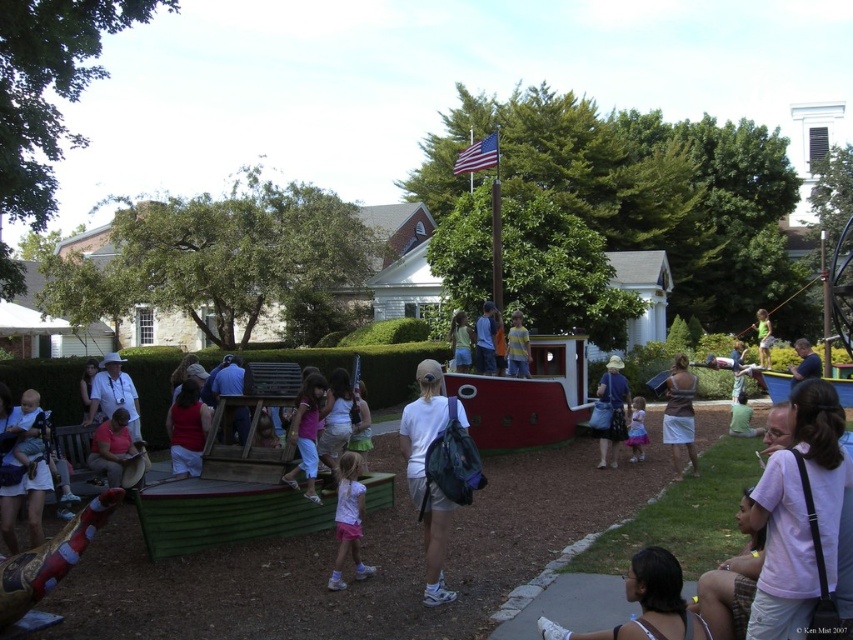
In the scene shown: Between white matte backpack at center and light blue denim shorts at center, which one is positioned lower?

white matte backpack at center

Is white matte backpack at center positioned behind light blue denim shorts at center?

No.

Is point (422, 472) closer to viewer compared to point (735, 378)?

Yes, it is.

This screenshot has height=640, width=853. Identify the location of white matte backpack at center. (424, 472).

Between white tank top at lower right and pink fabric dress at center, which one is positioned higher?

pink fabric dress at center

Between point (693, 611) and point (312, 380), which one is positioned behind?

The point (312, 380) is more distant.

Where is `white tank top at lower right`? white tank top at lower right is located at coordinates (645, 604).

Which of these two, green corrugated plastic boat at center or yellow striped shirt at center, stands shorter?

green corrugated plastic boat at center

Find the location of a particular element. green corrugated plastic boat at center is located at coordinates (229, 493).

Locate an element on the screen. The width and height of the screenshot is (853, 640). green corrugated plastic boat at center is located at coordinates (229, 493).